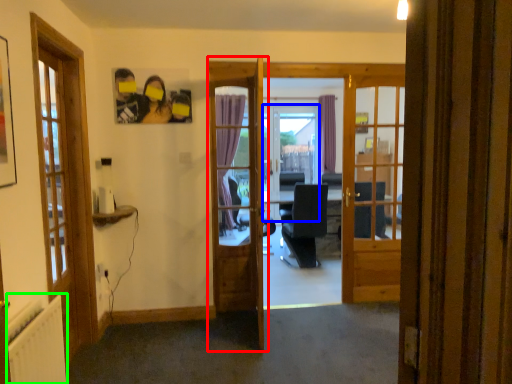
Question: Which object is the closest to the door (highlighted by a red box)? Choose among these: screen door (highlighted by a blue box) or radiator (highlighted by a green box).

Choices:
 (A) screen door
 (B) radiator

Answer: (B)